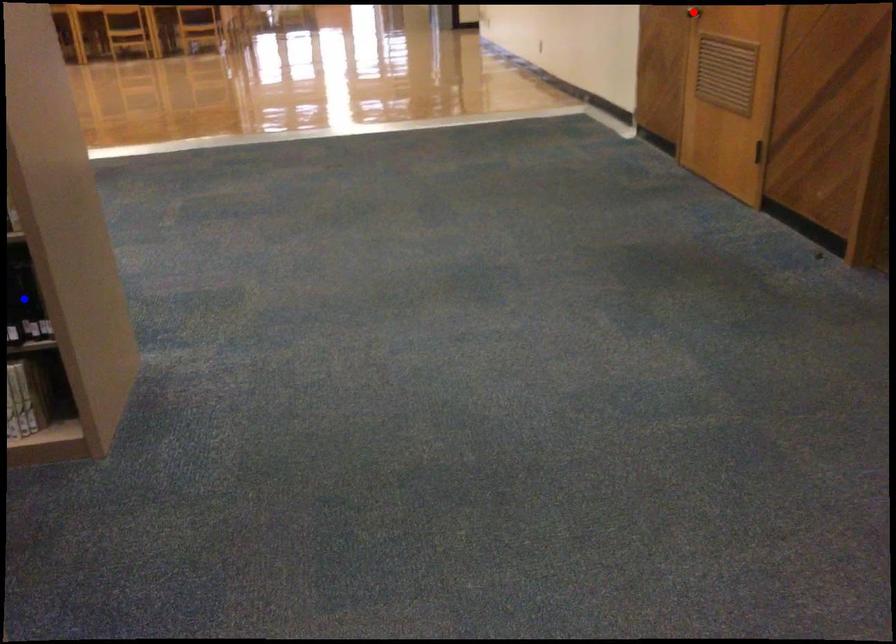
Question: Which of the two points in the image is closer to the camera?

Choices:
 (A) Blue point is closer.
 (B) Red point is closer.

Answer: (A)